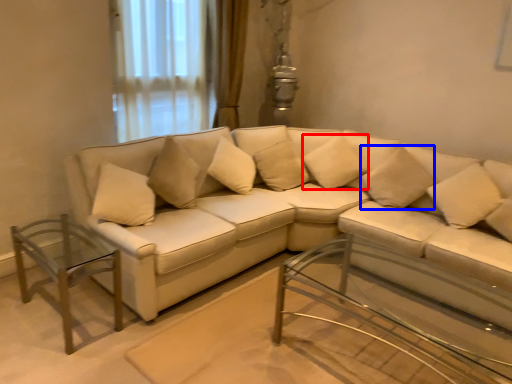
Question: Which object is further to the camera taking this photo, pillow (highlighted by a red box) or pillow (highlighted by a blue box)?

Choices:
 (A) pillow
 (B) pillow

Answer: (A)